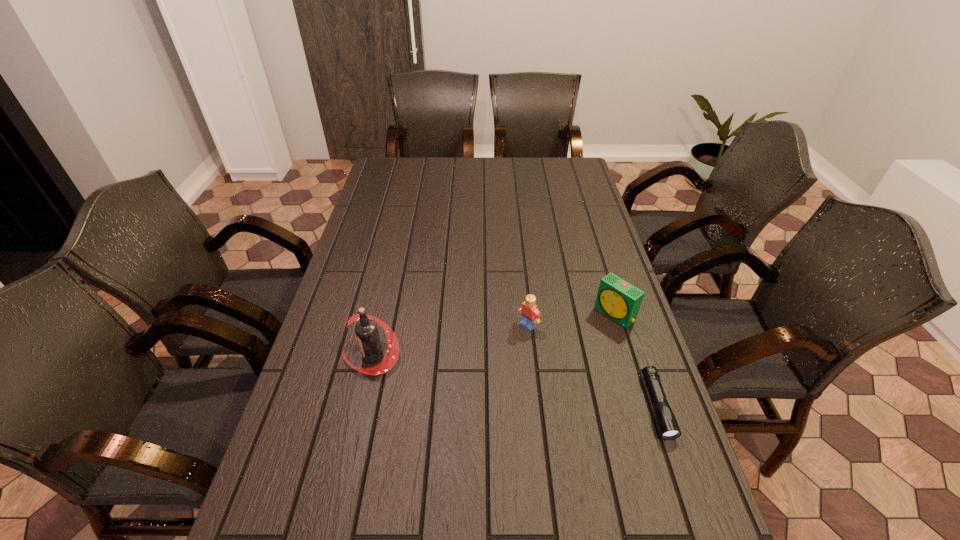
The image size is (960, 540). I want to click on object that can be found as the second closest to the Lego, so click(669, 429).

Select which object is the second closest to the shortest object. Please provide its 2D coordinates. Your answer should be formatted as a tuple, i.e. [(x, y)], where the tuple contains the x and y coordinates of a point satisfying the conditions above.

[(530, 314)]